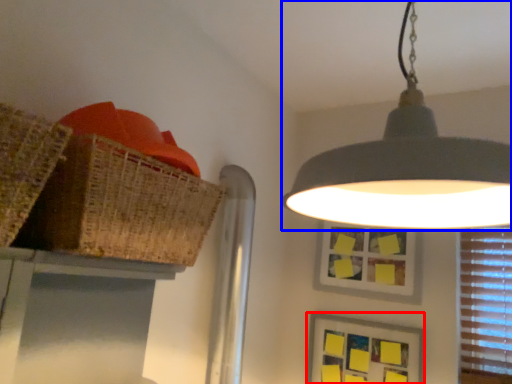
Question: Which object appears farthest to the camera in this image, picture frame (highlighted by a red box) or lamp (highlighted by a blue box)?

Choices:
 (A) picture frame
 (B) lamp

Answer: (A)